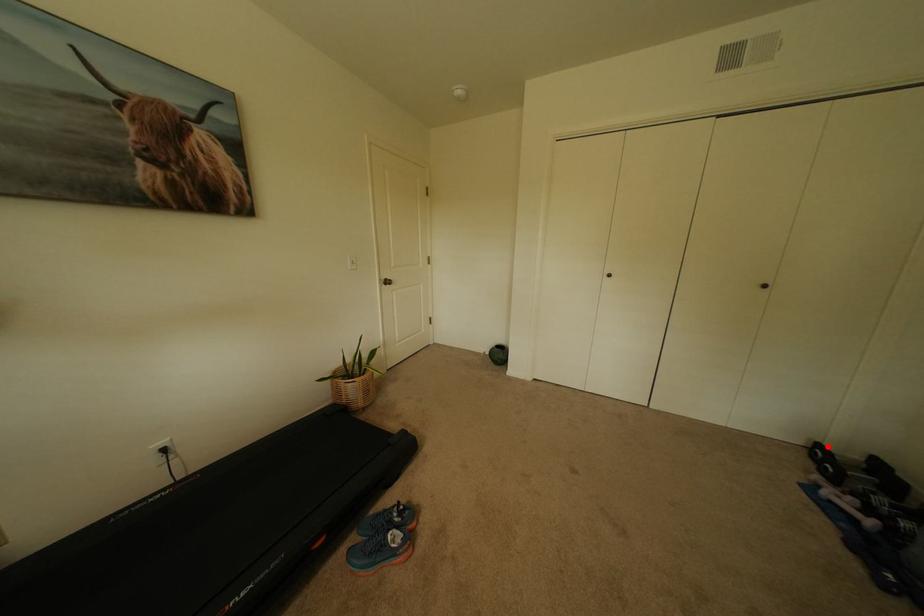
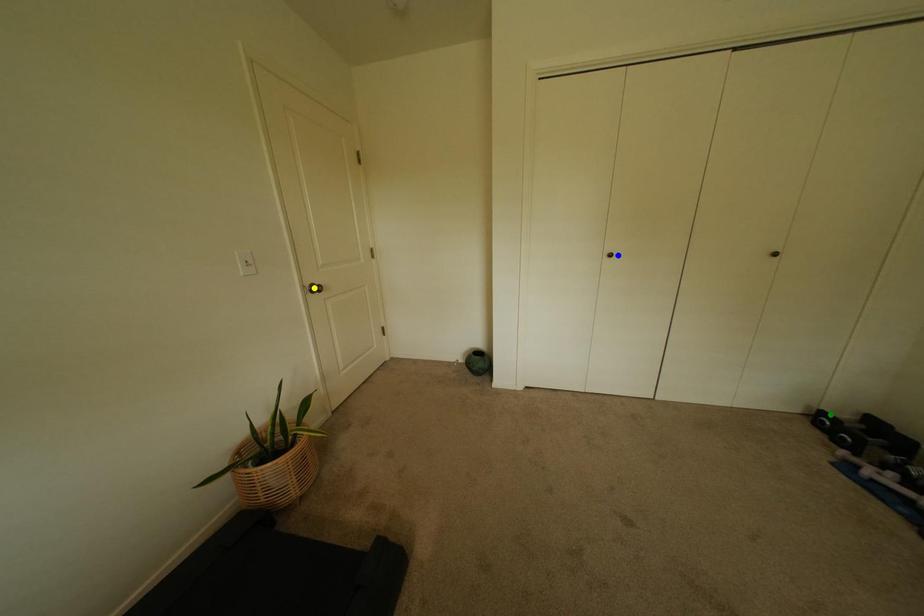
Question: I am providing you with two images of the same scene from different viewpoints. A red point is marked on the first image. You are given multiple points on the second image. In image 2, which mark is for the same physical point as the one in image 1?

Choices:
 (A) blue point
 (B) green point
 (C) yellow point

Answer: (B)